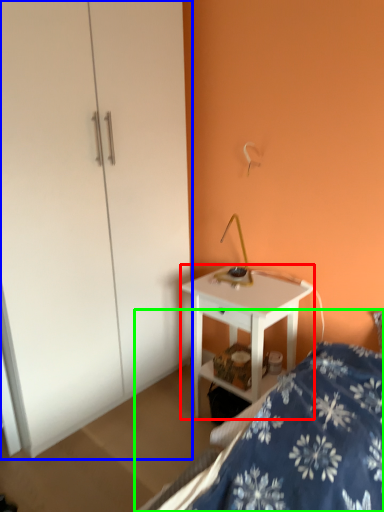
Question: Which is farther away from desk (highlighted by a red box)? dresser (highlighted by a blue box) or bed (highlighted by a green box)?

Choices:
 (A) dresser
 (B) bed

Answer: (A)